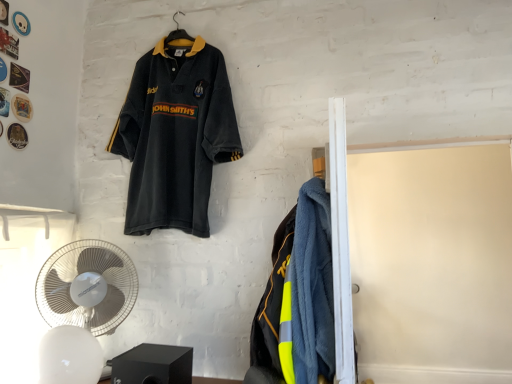
Question: Is velvet-like dark blue polo shirt at upper left to the right of white plastic mechanical fan at lower left, the 1th mechanical fan from the front, from the viewer's perspective?

Choices:
 (A) no
 (B) yes

Answer: (B)

Question: Is velvet-like dark blue polo shirt at upper left in front of white plastic mechanical fan at lower left, the 1th mechanical fan from the front?

Choices:
 (A) no
 (B) yes

Answer: (A)

Question: Is velvet-like dark blue polo shirt at upper left thinner than white plastic mechanical fan at lower left, the 1th mechanical fan from the front?

Choices:
 (A) yes
 (B) no

Answer: (A)

Question: Is velvet-like dark blue polo shirt at upper left smaller than white plastic mechanical fan at lower left, positioned as the 2th mechanical fan in back-to-front order?

Choices:
 (A) yes
 (B) no

Answer: (B)

Question: Does velvet-like dark blue polo shirt at upper left have a greater width compared to white plastic mechanical fan at lower left, positioned as the 2th mechanical fan in back-to-front order?

Choices:
 (A) no
 (B) yes

Answer: (A)

Question: Could you tell me if velvet-like dark blue polo shirt at upper left is facing white plastic mechanical fan at lower left, positioned as the 2th mechanical fan in back-to-front order?

Choices:
 (A) no
 (B) yes

Answer: (A)

Question: Is white plastic fan at lower left, which ranks as the 2th mechanical fan in front-to-back order, bigger than velvet-like dark blue polo shirt at upper left?

Choices:
 (A) yes
 (B) no

Answer: (B)

Question: Is white plastic fan at lower left, the 1th mechanical fan in the back-to-front sequence, outside velvet-like dark blue polo shirt at upper left?

Choices:
 (A) yes
 (B) no

Answer: (A)

Question: Considering the relative sizes of white plastic fan at lower left, which ranks as the 2th mechanical fan in front-to-back order, and velvet-like dark blue polo shirt at upper left in the image provided, is white plastic fan at lower left, which ranks as the 2th mechanical fan in front-to-back order, thinner than velvet-like dark blue polo shirt at upper left?

Choices:
 (A) yes
 (B) no

Answer: (A)

Question: Is velvet-like dark blue polo shirt at upper left at the back of white plastic fan at lower left, the 1th mechanical fan in the back-to-front sequence?

Choices:
 (A) yes
 (B) no

Answer: (B)

Question: Does white plastic fan at lower left, which ranks as the 2th mechanical fan in front-to-back order, come in front of velvet-like dark blue polo shirt at upper left?

Choices:
 (A) no
 (B) yes

Answer: (B)

Question: From a real-world perspective, is white plastic fan at lower left, the 1th mechanical fan in the back-to-front sequence, on top of velvet-like dark blue polo shirt at upper left?

Choices:
 (A) no
 (B) yes

Answer: (A)

Question: From a real-world perspective, does white plastic mechanical fan at lower left, positioned as the 2th mechanical fan in back-to-front order, sit lower than white plastic fan at lower left, the 1th mechanical fan in the back-to-front sequence?

Choices:
 (A) yes
 (B) no

Answer: (A)